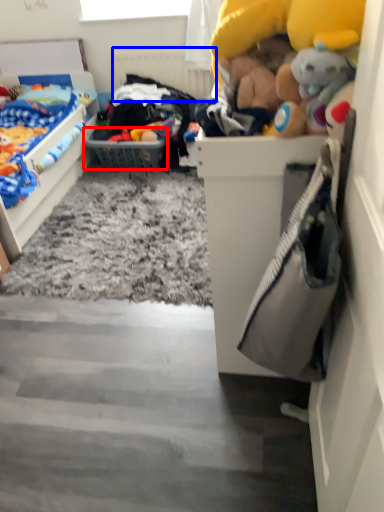
Question: Which of the following is the closest to the observer, picnic basket (highlighted by a red box) or radiator (highlighted by a blue box)?

Choices:
 (A) picnic basket
 (B) radiator

Answer: (A)